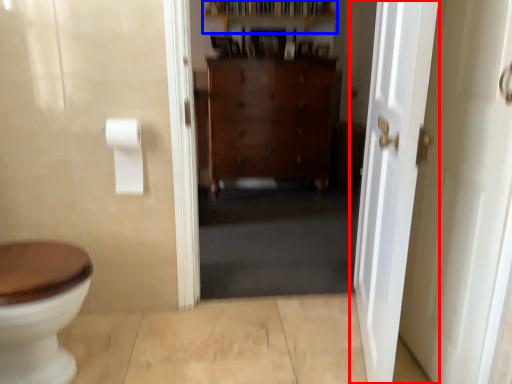
Question: Which object appears farthest to the camera in this image, door (highlighted by a red box) or shelf (highlighted by a blue box)?

Choices:
 (A) door
 (B) shelf

Answer: (B)